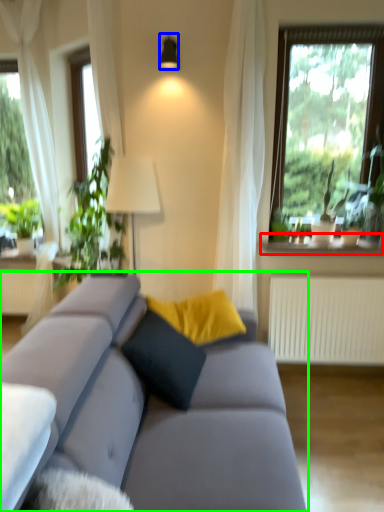
Question: Considering the real-world distances, which object is closest to window sill (highlighted by a red box)? lamp (highlighted by a blue box) or studio couch (highlighted by a green box).

Choices:
 (A) lamp
 (B) studio couch

Answer: (B)